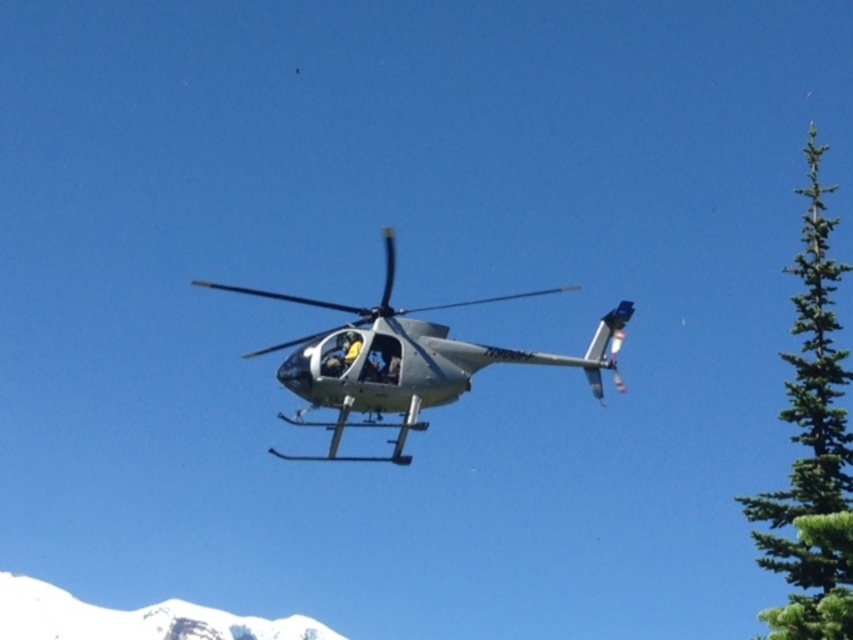
Can you confirm if green needle-like tree at right is positioned above metallic silver helicopter at center?

Yes.

Which of these two, green needle-like tree at right or metallic silver helicopter at center, stands shorter?

Standing shorter between the two is metallic silver helicopter at center.

This screenshot has height=640, width=853. Identify the location of green needle-like tree at right. (811, 445).

The height and width of the screenshot is (640, 853). In order to click on green needle-like tree at right in this screenshot , I will do `click(811, 445)`.

Is green needle-like tree at right shorter than yellow fabric skier at center?

Incorrect, green needle-like tree at right's height does not fall short of yellow fabric skier at center's.

Is green needle-like tree at right wider than yellow fabric skier at center?

Yes, green needle-like tree at right is wider than yellow fabric skier at center.

Find the location of a particular element. The image size is (853, 640). green needle-like tree at right is located at coordinates (811, 445).

Between metallic silver helicopter at center and yellow fabric skier at center, which one appears on the right side from the viewer's perspective?

Positioned to the right is metallic silver helicopter at center.

Is point (370, 355) farther from camera compared to point (337, 365)?

That is True.

Describe the element at coordinates (410, 362) in the screenshot. I see `metallic silver helicopter at center` at that location.

Find the location of a particular element. Image resolution: width=853 pixels, height=640 pixels. metallic silver helicopter at center is located at coordinates (410, 362).